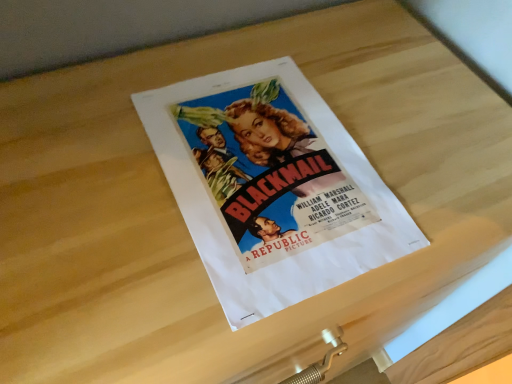
The width and height of the screenshot is (512, 384). What are the coordinates of `blank space situated above matte paper poster at center (from a real-world perspective)` in the screenshot? It's located at (272, 167).